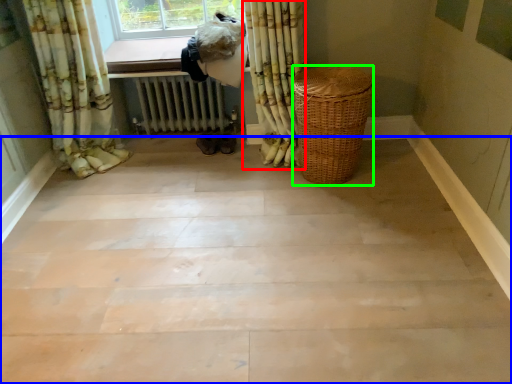
Question: Which object is positioned closest to curtain (highlighted by a red box)? Select from stairwell (highlighted by a blue box) and basket (highlighted by a green box).

Choices:
 (A) stairwell
 (B) basket

Answer: (B)